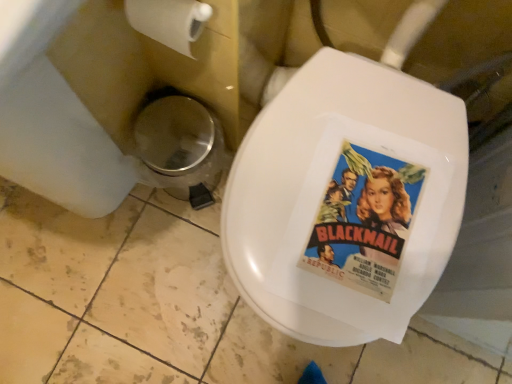
Question: From the image's perspective, is metallic silver trash can at lower left positioned above or below white matte toilet paper at upper left?

Choices:
 (A) above
 (B) below

Answer: (B)

Question: Is metallic silver trash can at lower left in front of or behind white matte toilet paper at upper left in the image?

Choices:
 (A) behind
 (B) front

Answer: (A)

Question: Which object is positioned farthest from the white matte toilet paper at upper left?

Choices:
 (A) metallic silver trash can at lower left
 (B) vintage paper movie poster at center

Answer: (B)

Question: Estimate the real-world distances between objects in this image. Which object is farther from the metallic silver trash can at lower left?

Choices:
 (A) vintage paper movie poster at center
 (B) white matte toilet paper at upper left

Answer: (A)